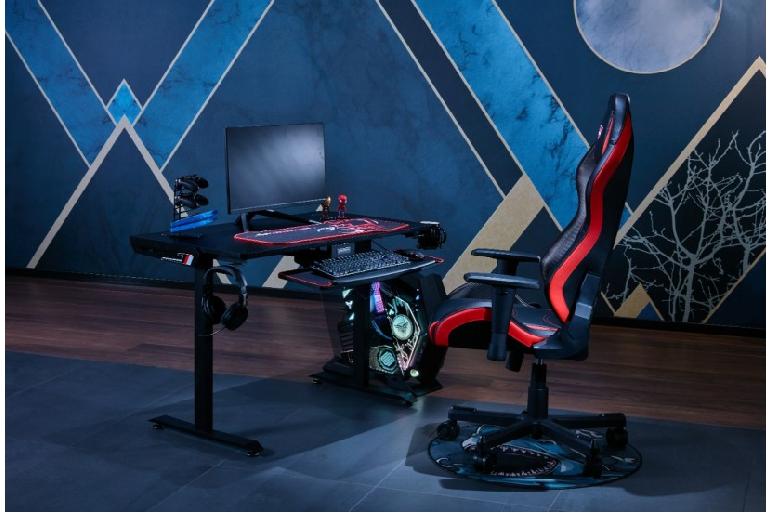
The image size is (768, 512). Identify the location of carpet pad with a design that has big teeth on it. (545, 454).